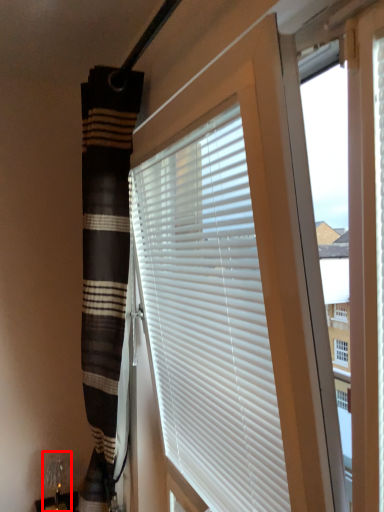
Question: From the image's perspective, what is the correct spatial positioning of table lamp (annotated by the red box) in reference to window blind?

Choices:
 (A) below
 (B) above

Answer: (A)